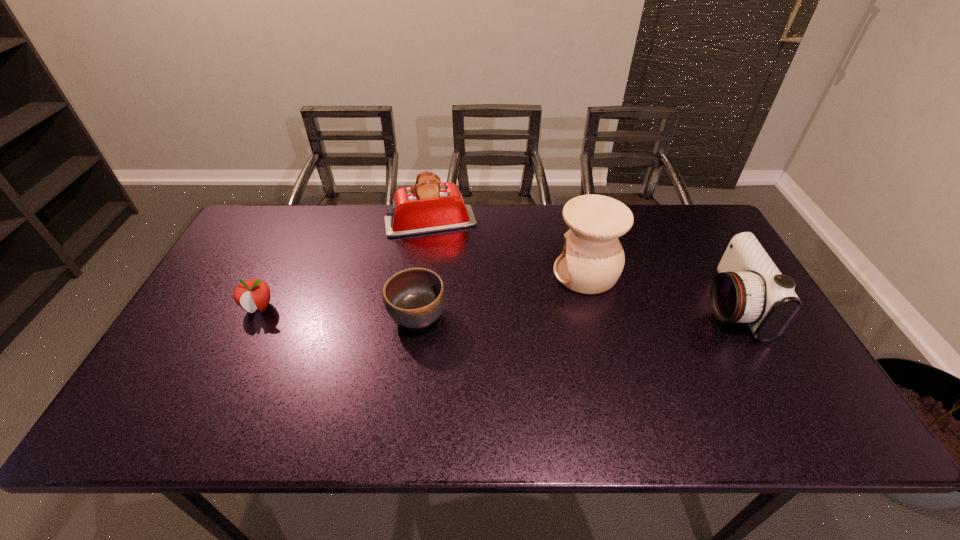
Locate an element on the screen. This screenshot has height=540, width=960. free region at the right edge of the desktop is located at coordinates (725, 350).

The height and width of the screenshot is (540, 960). In order to click on free space at the far left corner in this screenshot , I will do `click(246, 242)`.

Find the location of `free space at the far right corner`. free space at the far right corner is located at coordinates (679, 219).

The image size is (960, 540). Identify the location of vacant space at the near right corner of the desktop. (806, 423).

Find the location of `free area in between the camcorder and the apple`. free area in between the camcorder and the apple is located at coordinates (494, 306).

Identify the location of vacant space in between the tallest object and the farthest object. (508, 247).

This screenshot has width=960, height=540. Identify the location of free space between the rightmost object and the pottery. (658, 289).

Locate an element on the screen. Image resolution: width=960 pixels, height=540 pixels. free space between the bowl and the fourth object from left to right is located at coordinates (502, 295).

This screenshot has height=540, width=960. Identify the location of free space between the rightmost object and the apple. (494, 306).

Where is `the closest object to the bowl`? The image size is (960, 540). the closest object to the bowl is located at coordinates (429, 206).